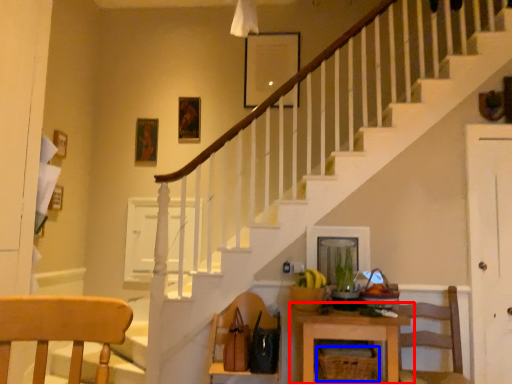
Question: Which of the following is the farthest to the observer, table (highlighted by a red box) or basket (highlighted by a blue box)?

Choices:
 (A) table
 (B) basket

Answer: (B)